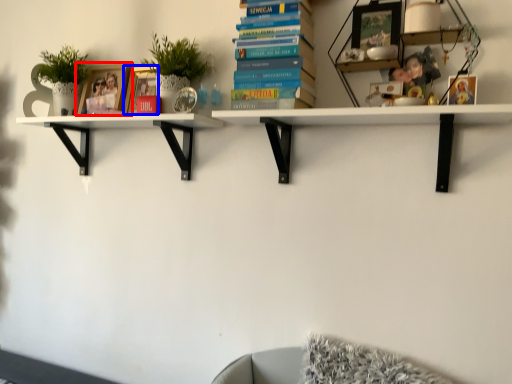
Question: Which object appears closest to the camera in this image, picture frame (highlighted by a red box) or picture frame (highlighted by a blue box)?

Choices:
 (A) picture frame
 (B) picture frame

Answer: (B)